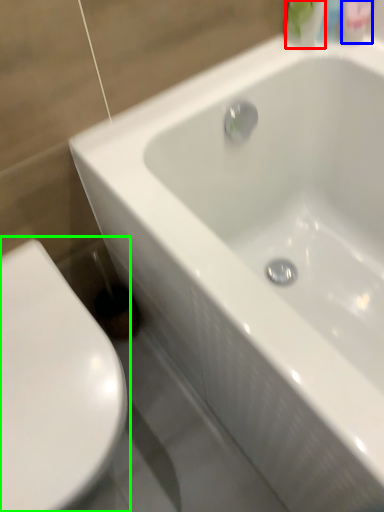
Question: Based on their relative distances, which object is nearer to mouthwash (highlighted by a red box)? Choose from mouthwash (highlighted by a blue box) and toilet (highlighted by a green box).

Choices:
 (A) mouthwash
 (B) toilet

Answer: (A)